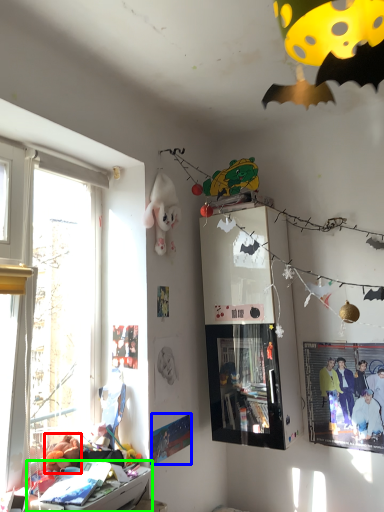
Question: Estimate the real-world distances between objects in this image. Which object is farther from toy (highlighted by a red box), poster page (highlighted by a blue box) or furniture (highlighted by a green box)?

Choices:
 (A) poster page
 (B) furniture

Answer: (A)